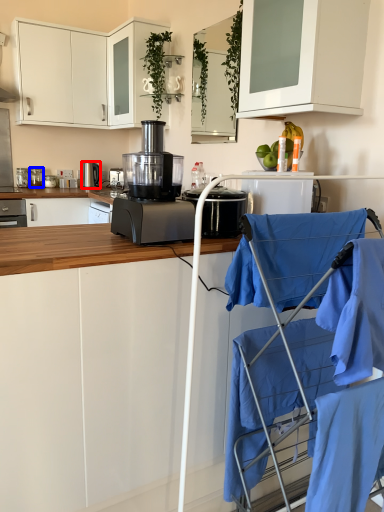
Question: Which point is closer to the camera, home appliance (highlighted by a red box) or kitchen appliance (highlighted by a blue box)?

Choices:
 (A) home appliance
 (B) kitchen appliance

Answer: (B)